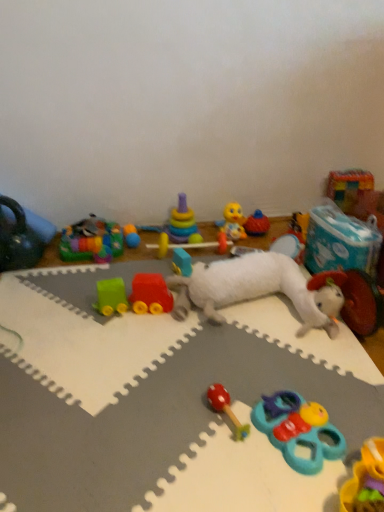
Locate an element on the screen. Image resolution: width=384 pixels, height=512 pixels. free space to the left of blue rubber toy at lower right, which is the fifth toy in right-to-left order is located at coordinates (219, 443).